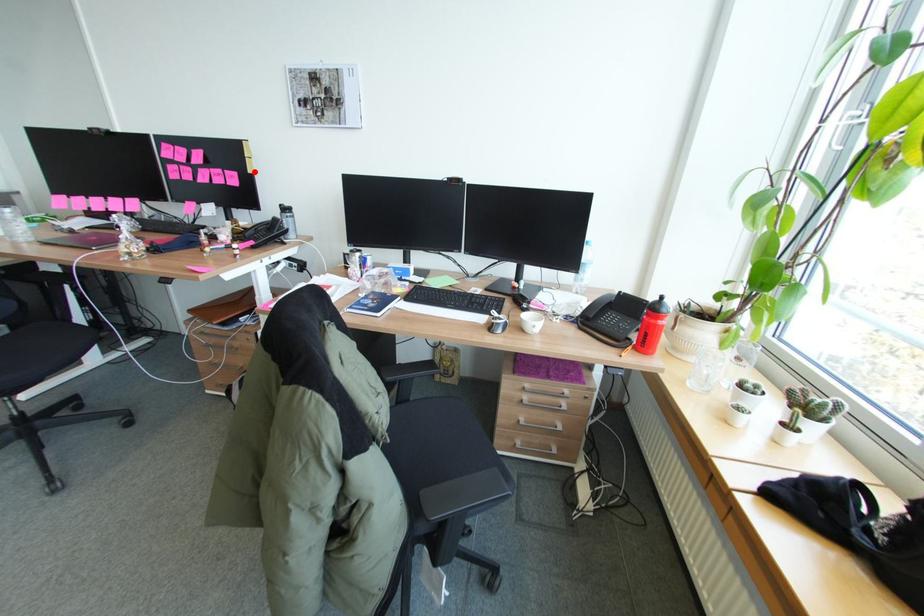
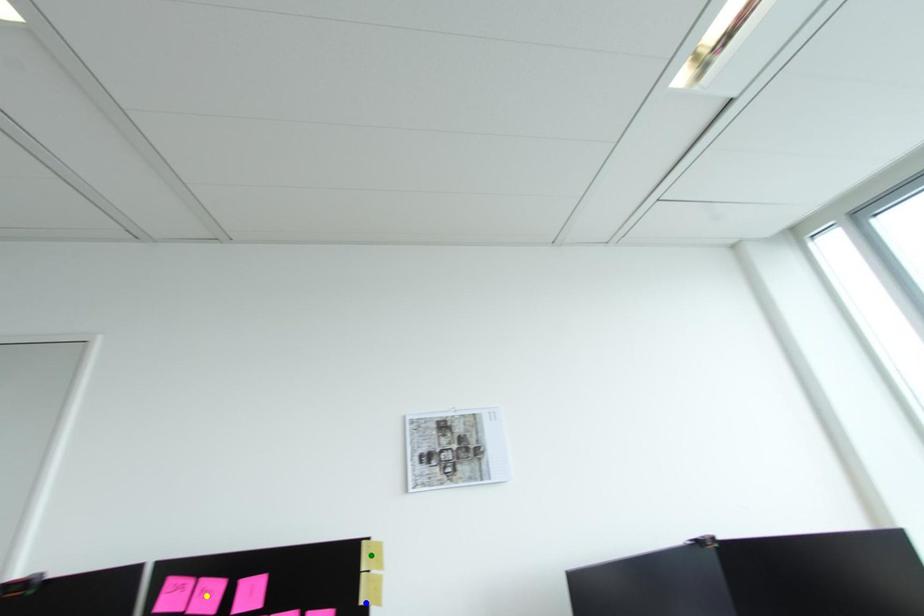
Question: I am providing you with two images of the same scene from different viewpoints. A red point is marked on the first image. You are given multiple points on the second image. Which point in image 2 is actually the same real-world point as the red point in image 1?

Choices:
 (A) green point
 (B) blue point
 (C) yellow point

Answer: (B)